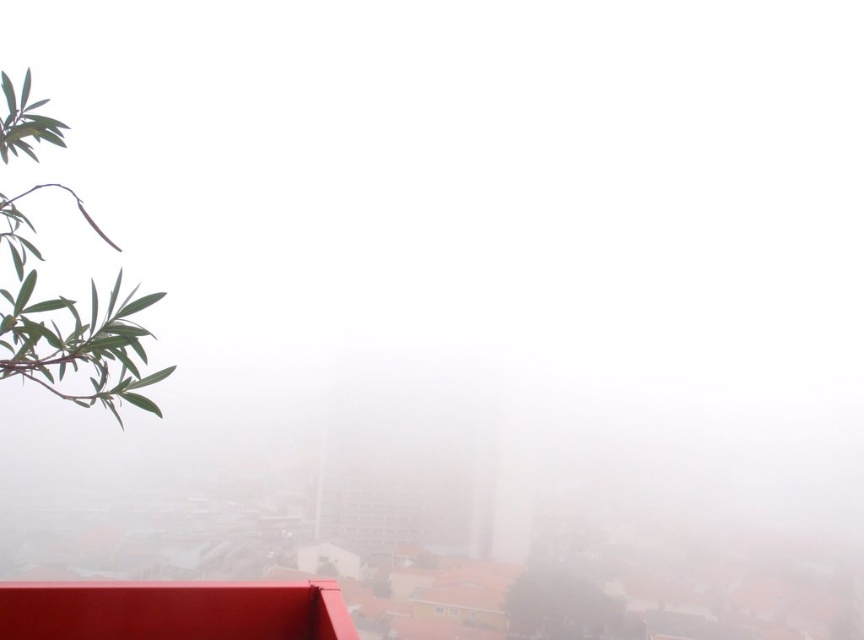
You are a bird flying over the foggy urban landscape. You spot the green leafy branch at upper left and the green leafy olive tree at lower left. Which one would you land on first if you are descending straight down?

The green leafy branch at upper left is shorter than the green leafy olive tree at lower left, so you would land on the green leafy branch at upper left first because it is closer to the ground.

You are a drone operator tasked with delivering a package from the green leafy branch at upper left to the green leafy olive tree at lower left. Given the drone has a maximum flight range of 120 meters, will it be able to complete the delivery without recharging?

The distance between the green leafy branch at upper left and the green leafy olive tree at lower left is 132.72 meters, which exceeds the drone operator maximum flight range of 120 meters. The drone will need to recharge before completing the delivery.